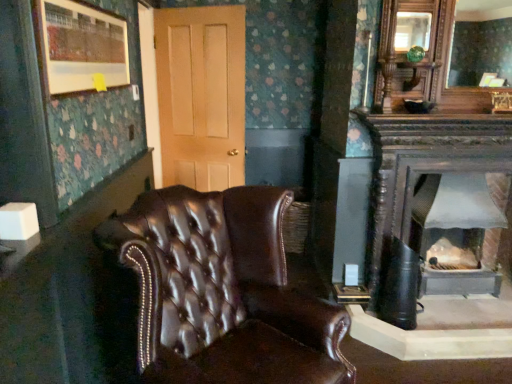
Measure the distance between point (224, 225) and camera.

Point (224, 225) and camera are 6.31 feet apart.

Locate an element on the screen. matte wooden picture frame at upper left is located at coordinates (82, 47).

Identify the location of matte wooden mirror at upper right. (481, 41).

Is gray metallic wood burning stove at right surrounding matte wooden picture frame at upper left?

No, matte wooden picture frame at upper left is not a part of gray metallic wood burning stove at right.

Is gray metallic wood burning stove at right closer to the viewer compared to matte wooden picture frame at upper left?

No, gray metallic wood burning stove at right is behind matte wooden picture frame at upper left.

The width and height of the screenshot is (512, 384). In order to click on picture frame above the gray metallic wood burning stove at right (from a real-world perspective) in this screenshot , I will do `click(82, 47)`.

Considering the points (447, 246) and (97, 75), which point is in front, point (447, 246) or point (97, 75)?

Point (97, 75)

From their relative heights in the image, would you say brown leather chair at center is taller or shorter than light brown wood door at center?

In the image, brown leather chair at center appears to be shorter than light brown wood door at center.

Does point (266, 373) appear closer or farther from the camera than point (241, 98)?

Clearly, point (266, 373) is closer to the camera than point (241, 98).

From the picture: Considering the positions of objects brown leather chair at center and light brown wood door at center in the image provided, who is behind, brown leather chair at center or light brown wood door at center?

light brown wood door at center.

At what (x,y) coordinates should I click in order to perform the action: click on door above the matte wooden picture frame at upper left (from the image's perspective). Please return your answer as a coordinate pair (x, y). The image size is (512, 384). Looking at the image, I should click on (201, 95).

From a real-world perspective, is light brown wood door at center physically located above or below matte wooden picture frame at upper left?

From a real-world perspective, light brown wood door at center is physically below matte wooden picture frame at upper left.

How many degrees apart are the facing directions of light brown wood door at center and matte wooden picture frame at upper left?

light brown wood door at center and matte wooden picture frame at upper left are facing 110 degrees away from each other.

Visually, is light brown wood door at center positioned to the left or to the right of matte wooden picture frame at upper left?

From the image, it's evident that light brown wood door at center is to the right of matte wooden picture frame at upper left.

In terms of width, does gray metallic wood burning stove at right look wider or thinner when compared to brown leather chair at center?

Clearly, gray metallic wood burning stove at right has less width compared to brown leather chair at center.

Based on the photo, can you confirm if gray metallic wood burning stove at right is shorter than brown leather chair at center?

Indeed, gray metallic wood burning stove at right has a lesser height compared to brown leather chair at center.

Looking at this image, from the image's perspective, which is above, gray metallic wood burning stove at right or brown leather chair at center?

From the image's view, gray metallic wood burning stove at right is above.

Considering the positions of points (490, 217) and (139, 337), is point (490, 217) farther from camera compared to point (139, 337)?

Yes, point (490, 217) is farther from viewer.

Does point (60, 57) appear closer or farther from the camera than point (462, 20)?

Point (60, 57) is closer to the camera than point (462, 20).

Is matte wooden picture frame at upper left placed right next to matte wooden mirror at upper right?

No, matte wooden picture frame at upper left is not next to matte wooden mirror at upper right.

From the image's perspective, is matte wooden picture frame at upper left located beneath matte wooden mirror at upper right?

Correct, matte wooden picture frame at upper left appears lower than matte wooden mirror at upper right in the image.

Which object is thinner, light brown wood door at center or brown leather chair at center?

light brown wood door at center is thinner.

The width and height of the screenshot is (512, 384). In order to click on door above the brown leather chair at center (from a real-world perspective) in this screenshot , I will do `click(201, 95)`.

Who is shorter, light brown wood door at center or brown leather chair at center?

brown leather chair at center.

From the image's perspective, who appears lower, light brown wood door at center or brown leather chair at center?

brown leather chair at center is shown below in the image.

Considering the sizes of brown leather chair at center and matte wooden picture frame at upper left in the image, is brown leather chair at center taller or shorter than matte wooden picture frame at upper left?

In the image, brown leather chair at center appears to be taller than matte wooden picture frame at upper left.

Is brown leather chair at center facing away from matte wooden picture frame at upper left?

brown leather chair at center is not turned away from matte wooden picture frame at upper left.

From a real-world perspective, which object stands above the other?

In real-world perspective, matte wooden picture frame at upper left is above.

Is brown leather chair at center bigger or smaller than matte wooden picture frame at upper left?

Clearly, brown leather chair at center is larger in size than matte wooden picture frame at upper left.

You are a GUI agent. You are given a task and a screenshot of the screen. Output one action in this format:
    pyautogui.click(x=<x>, y=<y>)
    Task: Click on the wood burning stove behind the matte wooden picture frame at upper left
    The width and height of the screenshot is (512, 384).
    Given the screenshot: What is the action you would take?
    pyautogui.click(x=454, y=234)

Identify the location of door to the left of brown leather chair at center. The width and height of the screenshot is (512, 384). (201, 95).

Estimate the real-world distances between objects in this image. Which object is further from matte wooden picture frame at upper left, brown leather chair at center or gray metallic wood burning stove at right?

gray metallic wood burning stove at right lies further to matte wooden picture frame at upper left than the other object.

When comparing their distances from matte wooden mirror at upper right, does gray metallic wood burning stove at right or brown leather chair at center seem closer?

gray metallic wood burning stove at right is positioned closer to the anchor matte wooden mirror at upper right.

Based on their spatial positions, is brown leather chair at center or light brown wood door at center closer to matte wooden mirror at upper right?

The object closer to matte wooden mirror at upper right is light brown wood door at center.

Based on their spatial positions, is matte wooden mirror at upper right or light brown wood door at center closer to gray metallic wood burning stove at right?

light brown wood door at center is positioned closer to the anchor gray metallic wood burning stove at right.

Estimate the real-world distances between objects in this image. Which object is further from matte wooden mirror at upper right, brown leather chair at center or gray metallic wood burning stove at right?

brown leather chair at center lies further to matte wooden mirror at upper right than the other object.

Estimate the real-world distances between objects in this image. Which object is closer to brown leather chair at center, gray metallic wood burning stove at right or matte wooden mirror at upper right?

gray metallic wood burning stove at right is positioned closer to the anchor brown leather chair at center.

Based on the photo, when comparing their distances from light brown wood door at center, does brown leather chair at center or gray metallic wood burning stove at right seem further?

brown leather chair at center.

From the image, which object appears to be nearer to light brown wood door at center, matte wooden mirror at upper right or gray metallic wood burning stove at right?

gray metallic wood burning stove at right lies closer to light brown wood door at center than the other object.

At what (x,y) coordinates should I click in order to perform the action: click on wood burning stove between brown leather chair at center and light brown wood door at center in the front-back direction. Please return your answer as a coordinate pair (x, y). Looking at the image, I should click on (454, 234).

Locate an element on the screen. mirror between matte wooden picture frame at upper left and gray metallic wood burning stove at right is located at coordinates (481, 41).

In order to click on mirror situated between light brown wood door at center and gray metallic wood burning stove at right from left to right in this screenshot , I will do `click(481, 41)`.

The height and width of the screenshot is (384, 512). Find the location of `mirror between brown leather chair at center and gray metallic wood burning stove at right from front to back`. mirror between brown leather chair at center and gray metallic wood burning stove at right from front to back is located at coordinates (481, 41).